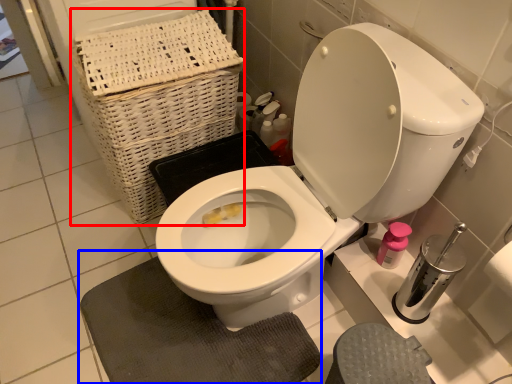
Question: Which of the following is the farthest to the observer, basket (highlighted by a red box) or bath mat (highlighted by a blue box)?

Choices:
 (A) basket
 (B) bath mat

Answer: (A)